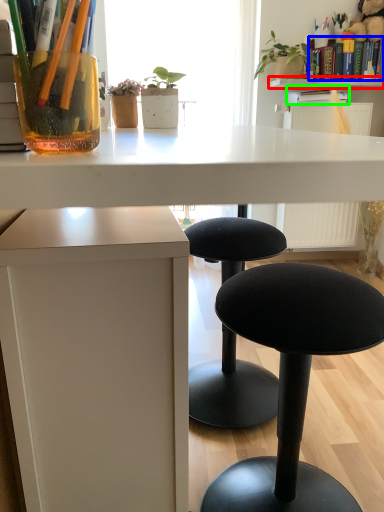
Question: Which object is positioned closest to window sill (highlighted by a red box)? Select from book (highlighted by a blue box) and book (highlighted by a green box).

Choices:
 (A) book
 (B) book

Answer: (B)